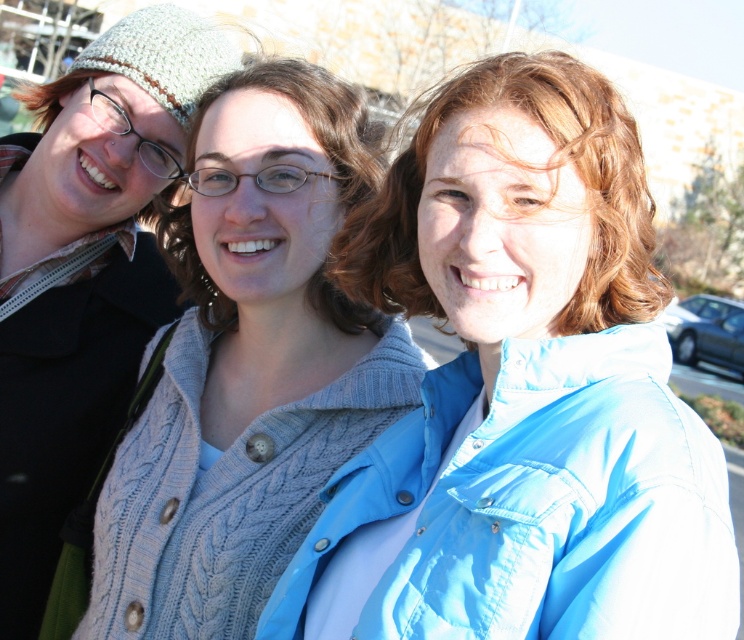
Can you confirm if knitted gray sweater at center is wider than knitted sweater at center?

Yes, knitted gray sweater at center is wider than knitted sweater at center.

Who is lower down, knitted gray sweater at center or knitted sweater at center?

knitted sweater at center is lower down.

Find the location of `knitted gray sweater at center`. knitted gray sweater at center is located at coordinates (248, 365).

I want to click on knitted gray sweater at center, so click(x=248, y=365).

Between blue quilted jacket at center and light brown hair at center, which one is positioned lower?

Positioned lower is blue quilted jacket at center.

Can you confirm if blue quilted jacket at center is positioned below light brown hair at center?

Yes.

Which is behind, point (583, 307) or point (562, 52)?

The point (562, 52) is behind.

Find the location of a particular element. The width and height of the screenshot is (744, 640). blue quilted jacket at center is located at coordinates (519, 392).

Is knitted gray sweater at center thinner than light brown hair at center?

No, knitted gray sweater at center is not thinner than light brown hair at center.

Measure the distance between knitted gray sweater at center and camera.

A distance of 5.53 meters exists between knitted gray sweater at center and camera.

The image size is (744, 640). In order to click on knitted gray sweater at center in this screenshot , I will do `click(248, 365)`.